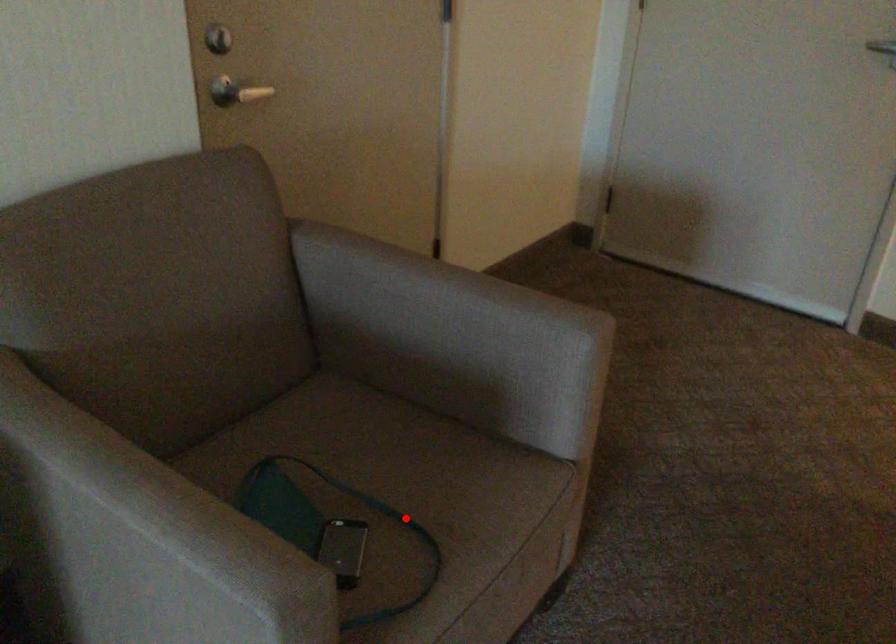
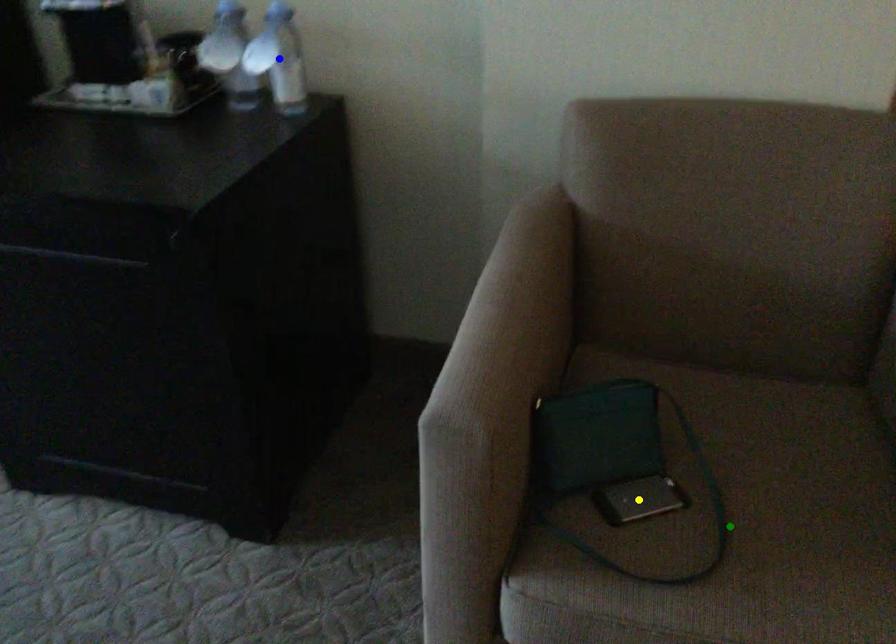
Question: I am providing you with two images of the same scene from different viewpoints. A red point is marked on the first image. You are given multiple points on the second image. Which point in image 2 is actually the same real-world point as the red point in image 1?

Choices:
 (A) green point
 (B) yellow point
 (C) blue point

Answer: (A)